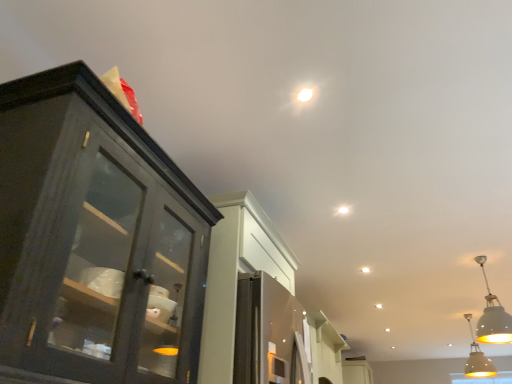
You are a GUI agent. You are given a task and a screenshot of the screen. Output one action in this format:
    pyautogui.click(x=<x>, y=<y>)
    Task: Click on the white matte pendant light at lower right, the 2th light fixture when ordered from right to left
    This screenshot has width=512, height=384.
    Given the screenshot: What is the action you would take?
    pyautogui.click(x=493, y=317)

What is the approximate width of white matte pendant light at lower right, which appears as the 1th light fixture when viewed from the left?

white matte pendant light at lower right, which appears as the 1th light fixture when viewed from the left, is 14.45 inches wide.

Describe the element at coordinates (325, 348) in the screenshot. The width and height of the screenshot is (512, 384). I see `white matte cabinet at center` at that location.

Based on the photo, what is the approximate height of white matte cabinet at center?

It is 9.12 inches.

The image size is (512, 384). Identify the location of matte yellow pendant light at lower right, positioned as the 2th light fixture in front-to-back order. (477, 359).

What are the coordinates of `white matte pendant light at lower right, which is the 1th light fixture from top to bottom` in the screenshot? It's located at (493, 317).

Does matte yellow pendant light at lower right, positioned as the 2th light fixture in front-to-back order, appear on the left side of white matte ceiling light at upper center?

No.

Can you tell me how much matte yellow pendant light at lower right, the second light fixture when ordered from left to right, and white matte ceiling light at upper center differ in facing direction?

The facing directions of matte yellow pendant light at lower right, the second light fixture when ordered from left to right, and white matte ceiling light at upper center are 91.7 degrees apart.

Does matte yellow pendant light at lower right, the second light fixture when ordered from left to right, have a greater width compared to white matte ceiling light at upper center?

Yes, matte yellow pendant light at lower right, the second light fixture when ordered from left to right, is wider than white matte ceiling light at upper center.

Looking at this image, looking at the image, does matte yellow pendant light at lower right, positioned as the 2th light fixture in front-to-back order, seem bigger or smaller compared to white matte ceiling light at upper center?

Considering their sizes, matte yellow pendant light at lower right, positioned as the 2th light fixture in front-to-back order, takes up more space than white matte ceiling light at upper center.

Between white matte pendant light at lower right, the 2th light fixture when ordered from right to left, and white matte droplight at upper center, which one has more height?

white matte pendant light at lower right, the 2th light fixture when ordered from right to left.

Is white matte pendant light at lower right, marked as the second light fixture in a bottom-to-top arrangement, surrounding white matte droplight at upper center?

No, white matte droplight at upper center is located outside of white matte pendant light at lower right, marked as the second light fixture in a bottom-to-top arrangement.

In the scene shown: Which object is thinner, white matte pendant light at lower right, which appears as the 2th light fixture when viewed from the back, or white matte droplight at upper center?

With smaller width is white matte droplight at upper center.

From the image's perspective, is white matte cabinet at center located above or below white matte ceiling light at upper center?

white matte cabinet at center is situated lower than white matte ceiling light at upper center in the image.

Is white matte cabinet at center positioned behind white matte ceiling light at upper center?

Yes, white matte cabinet at center is behind white matte ceiling light at upper center.

Identify the location of cabinetry below the white matte ceiling light at upper center (from the image's perspective). (325, 348).

Does white matte cabinet at center appear on the right side of white matte ceiling light at upper center?

Yes.

You are a GUI agent. You are given a task and a screenshot of the screen. Output one action in this format:
    pyautogui.click(x=<x>, y=<y>)
    Task: Click on the cabinetry below the white matte droplight at upper center (from the image's perspective)
    The height and width of the screenshot is (384, 512).
    Given the screenshot: What is the action you would take?
    pyautogui.click(x=325, y=348)

From the image's perspective, between white matte cabinet at center and white matte droplight at upper center, which one is located above?

white matte droplight at upper center, from the image's perspective.

Between white matte cabinet at center and white matte droplight at upper center, which one appears on the right side from the viewer's perspective?

white matte cabinet at center.

Can you confirm if white matte ceiling light at upper center is taller than white matte cabinet at center?

No, white matte ceiling light at upper center is not taller than white matte cabinet at center.

Considering the positions of objects white matte ceiling light at upper center and white matte cabinet at center in the image provided, who is in front, white matte ceiling light at upper center or white matte cabinet at center?

white matte ceiling light at upper center is closer to the camera.

Is point (346, 208) less distant than point (316, 339)?

Yes, it is.

Does point (341, 213) appear closer or farther from the camera than point (308, 90)?

Point (341, 213) is positioned farther from the camera compared to point (308, 90).

From a real-world perspective, relative to white matte droplight at upper center, is white matte ceiling light at upper center vertically above or below?

white matte ceiling light at upper center is above white matte droplight at upper center.

Can you confirm if white matte ceiling light at upper center is wider than white matte droplight at upper center?

No, white matte ceiling light at upper center is not wider than white matte droplight at upper center.

Does white matte ceiling light at upper center have a smaller size compared to white matte droplight at upper center?

Yes, white matte ceiling light at upper center is smaller than white matte droplight at upper center.

From the image's perspective, relative to white matte cabinet at center, is matte yellow pendant light at lower right, marked as the first light fixture in a back-to-front arrangement, above or below?

Clearly, from the image's perspective, matte yellow pendant light at lower right, marked as the first light fixture in a back-to-front arrangement, is below white matte cabinet at center.

How far apart are matte yellow pendant light at lower right, positioned as the 2th light fixture in front-to-back order, and white matte cabinet at center?

matte yellow pendant light at lower right, positioned as the 2th light fixture in front-to-back order, and white matte cabinet at center are 2.18 meters apart.

Is matte yellow pendant light at lower right, which is counted as the second light fixture, starting from the top, behind white matte cabinet at center?

Yes.

Which is in front, point (468, 373) or point (339, 341)?

The point (339, 341) is in front.

The image size is (512, 384). In order to click on light that is above the matte yellow pendant light at lower right, which is counted as the first light fixture, starting from the right (from the image's perspective) in this screenshot , I will do click(343, 210).

Where is `droplight in front of the white matte pendant light at lower right, which is the 1th light fixture from top to bottom`? The width and height of the screenshot is (512, 384). droplight in front of the white matte pendant light at lower right, which is the 1th light fixture from top to bottom is located at coordinates (305, 94).

Which object lies further to the anchor point white matte ceiling light at upper center, matte yellow pendant light at lower right, the second light fixture when ordered from left to right, or white matte pendant light at lower right, marked as the second light fixture in a bottom-to-top arrangement?

matte yellow pendant light at lower right, the second light fixture when ordered from left to right.

Looking at the image, which one is located closer to white matte ceiling light at upper center, white matte pendant light at lower right, which appears as the 1th light fixture when viewed from the left, or white matte cabinet at center?

white matte pendant light at lower right, which appears as the 1th light fixture when viewed from the left, is positioned closer to the anchor white matte ceiling light at upper center.

From the image, which object appears to be nearer to matte yellow pendant light at lower right, marked as the first light fixture in a back-to-front arrangement, white matte pendant light at lower right, which is the 1th light fixture from top to bottom, or white matte ceiling light at upper center?

The object closer to matte yellow pendant light at lower right, marked as the first light fixture in a back-to-front arrangement, is white matte pendant light at lower right, which is the 1th light fixture from top to bottom.

Based on their spatial positions, is white matte pendant light at lower right, which is the 1th light fixture from top to bottom, or matte yellow pendant light at lower right, which is counted as the second light fixture, starting from the top, closer to white matte droplight at upper center?

white matte pendant light at lower right, which is the 1th light fixture from top to bottom, is closer to white matte droplight at upper center.

Looking at the image, which one is located further to white matte cabinet at center, white matte ceiling light at upper center or white matte pendant light at lower right, which appears as the 1th light fixture when viewed from the left?

The object further to white matte cabinet at center is white matte ceiling light at upper center.

Based on their spatial positions, is white matte pendant light at lower right, which is the 1th light fixture from top to bottom, or white matte ceiling light at upper center further from white matte cabinet at center?

white matte ceiling light at upper center.

Looking at the image, which one is located closer to white matte pendant light at lower right, marked as the second light fixture in a bottom-to-top arrangement, white matte droplight at upper center or matte yellow pendant light at lower right, which is counted as the first light fixture, starting from the right?

matte yellow pendant light at lower right, which is counted as the first light fixture, starting from the right, lies closer to white matte pendant light at lower right, marked as the second light fixture in a bottom-to-top arrangement, than the other object.

When comparing their distances from white matte ceiling light at upper center, does white matte cabinet at center or white matte droplight at upper center seem closer?

Among the two, white matte droplight at upper center is located nearer to white matte ceiling light at upper center.

At what (x,y) coordinates should I click in order to perform the action: click on cabinetry between white matte ceiling light at upper center and matte yellow pendant light at lower right, positioned as the 2th light fixture in front-to-back order, in the horizontal direction. Please return your answer as a coordinate pair (x, y). The image size is (512, 384). Looking at the image, I should click on (325, 348).

Identify the location of light fixture situated between white matte ceiling light at upper center and matte yellow pendant light at lower right, the second light fixture when ordered from left to right, from left to right. (493, 317).

The width and height of the screenshot is (512, 384). Find the location of `light that lies between white matte droplight at upper center and white matte cabinet at center from top to bottom`. light that lies between white matte droplight at upper center and white matte cabinet at center from top to bottom is located at coordinates (343, 210).

Find the location of a particular element. This screenshot has width=512, height=384. light fixture between white matte droplight at upper center and white matte cabinet at center from top to bottom is located at coordinates (493, 317).